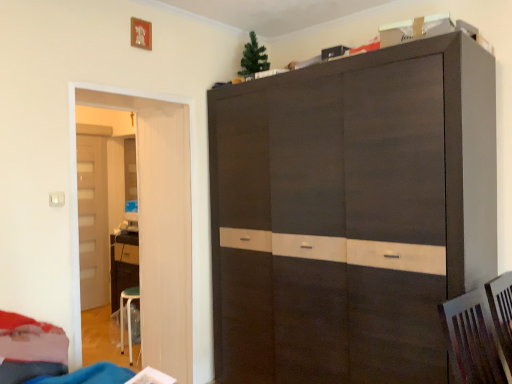
Question: From a real-world perspective, is velvet red bed at lower left located higher than light brown wood door at left, which ranks as the 1th door in back-to-front order?

Choices:
 (A) no
 (B) yes

Answer: (A)

Question: From the image's perspective, would you say velvet red bed at lower left is positioned over light brown wood door at left, positioned as the first door in left-to-right order?

Choices:
 (A) yes
 (B) no

Answer: (B)

Question: Does velvet red bed at lower left turn towards light brown wood door at left, the 2th door in the front-to-back sequence?

Choices:
 (A) no
 (B) yes

Answer: (A)

Question: Is velvet red bed at lower left at the left side of light brown wood door at left, positioned as the first door in left-to-right order?

Choices:
 (A) yes
 (B) no

Answer: (B)

Question: Would you say velvet red bed at lower left is outside light brown wood door at left, the 2th door in the front-to-back sequence?

Choices:
 (A) no
 (B) yes

Answer: (B)

Question: Considering the relative sizes of velvet red bed at lower left and light brown wood door at left, the 2th door in the front-to-back sequence, in the image provided, is velvet red bed at lower left taller than light brown wood door at left, the 2th door in the front-to-back sequence,?

Choices:
 (A) yes
 (B) no

Answer: (B)

Question: From a real-world perspective, is white glossy door at left, which appears as the first door when viewed from the front, on top of velvet red bed at lower left?

Choices:
 (A) no
 (B) yes

Answer: (B)

Question: From the image's perspective, is white glossy door at left, which is the 2th door in left-to-right order, located beneath velvet red bed at lower left?

Choices:
 (A) no
 (B) yes

Answer: (A)

Question: Is white glossy door at left, the first door in the right-to-left sequence, placed right next to velvet red bed at lower left?

Choices:
 (A) no
 (B) yes

Answer: (A)

Question: Would you say white glossy door at left, positioned as the second door in back-to-front order, contains velvet red bed at lower left?

Choices:
 (A) yes
 (B) no

Answer: (B)

Question: Considering the relative sizes of white glossy door at left, which is the 2th door in left-to-right order, and velvet red bed at lower left in the image provided, is white glossy door at left, which is the 2th door in left-to-right order, shorter than velvet red bed at lower left?

Choices:
 (A) yes
 (B) no

Answer: (B)

Question: Is white glossy door at left, which appears as the first door when viewed from the front, at the right side of velvet red bed at lower left?

Choices:
 (A) yes
 (B) no

Answer: (A)

Question: Does velvet red bed at lower left contain white glossy door at left, the first door in the right-to-left sequence?

Choices:
 (A) yes
 (B) no

Answer: (B)